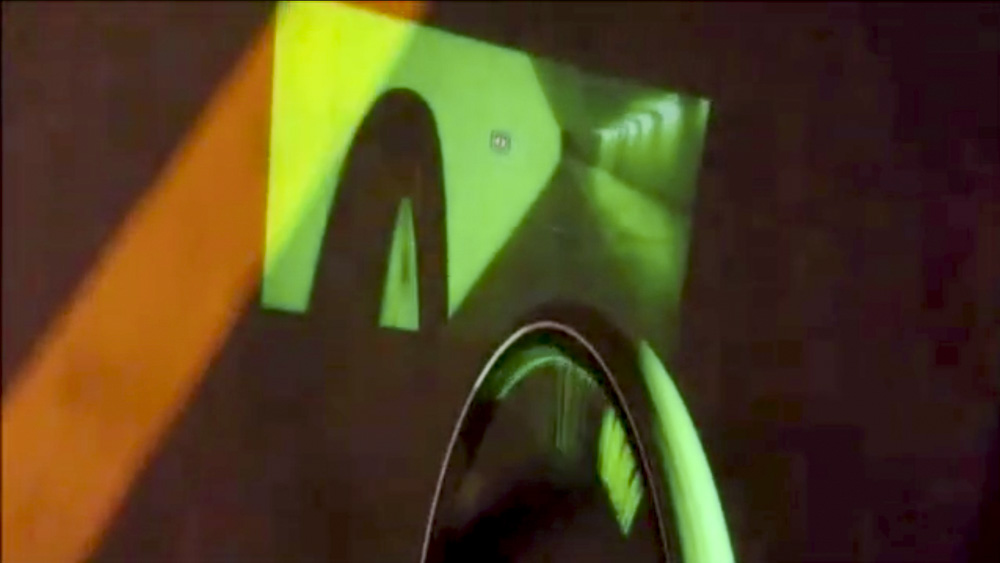
Where is `green door`? green door is located at coordinates click(576, 148).